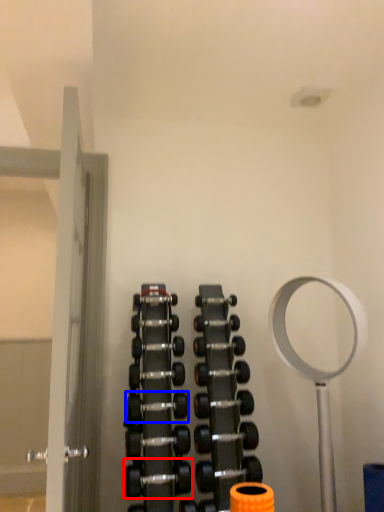
Question: Which point is closer to the camera, dumbbell (highlighted by a red box) or dumbbell (highlighted by a blue box)?

Choices:
 (A) dumbbell
 (B) dumbbell

Answer: (A)